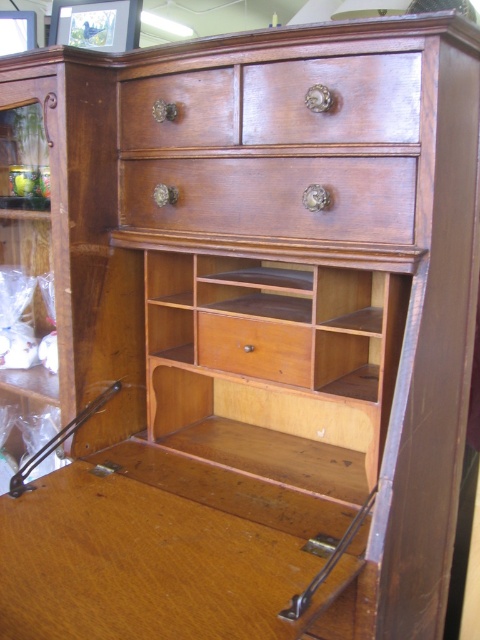
Does polished wood drawer at center appear on the right side of wooden drawer at center?

No, polished wood drawer at center is not to the right of wooden drawer at center.

Measure the distance from polished wood drawer at center to wooden drawer at center.

They are 10.93 inches apart.

Is point (205, 196) closer to viewer compared to point (207, 316)?

That is True.

Identify the location of polished wood drawer at center. (275, 196).

In the scene shown: Does matte wood drawer at upper center have a larger size compared to wooden drawer at center?

Indeed, matte wood drawer at upper center has a larger size compared to wooden drawer at center.

Does matte wood drawer at upper center appear over wooden drawer at center?

Yes, matte wood drawer at upper center is above wooden drawer at center.

Describe the element at coordinates (180, 109) in the screenshot. I see `matte wood drawer at upper center` at that location.

Where is `matte wood drawer at upper center`? Image resolution: width=480 pixels, height=640 pixels. matte wood drawer at upper center is located at coordinates (180, 109).

Can you confirm if wooden desk at center is taller than wooden drawer at center?

Indeed, wooden desk at center has a greater height compared to wooden drawer at center.

Does wooden desk at center appear under wooden drawer at center?

Correct, wooden desk at center is located below wooden drawer at center.

Does point (57, 536) lie behind point (288, 324)?

No, it is not.

Identify the location of wooden desk at center. The image size is (480, 640). (163, 552).